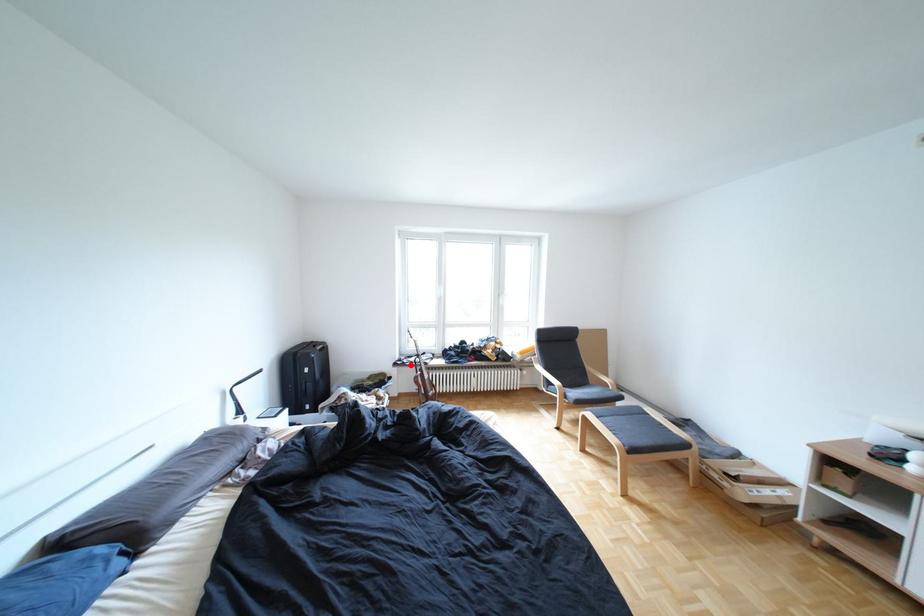
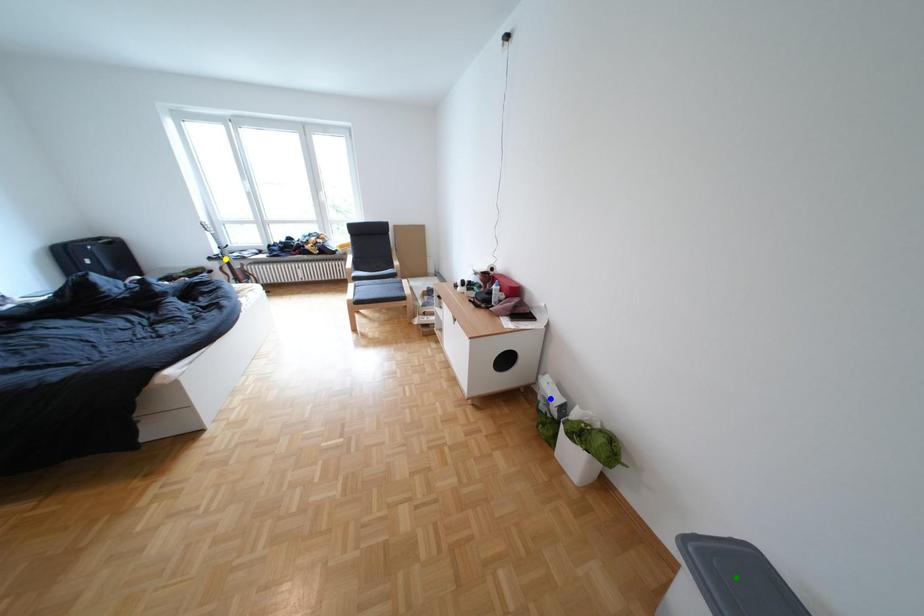
Question: I am providing you with two images of the same scene from different viewpoints. A red point is marked on the first image. You are given multiple points on the second image. Which point in image 2 is actually the same real-world point as the red point in image 1?

Choices:
 (A) yellow point
 (B) green point
 (C) blue point

Answer: (A)